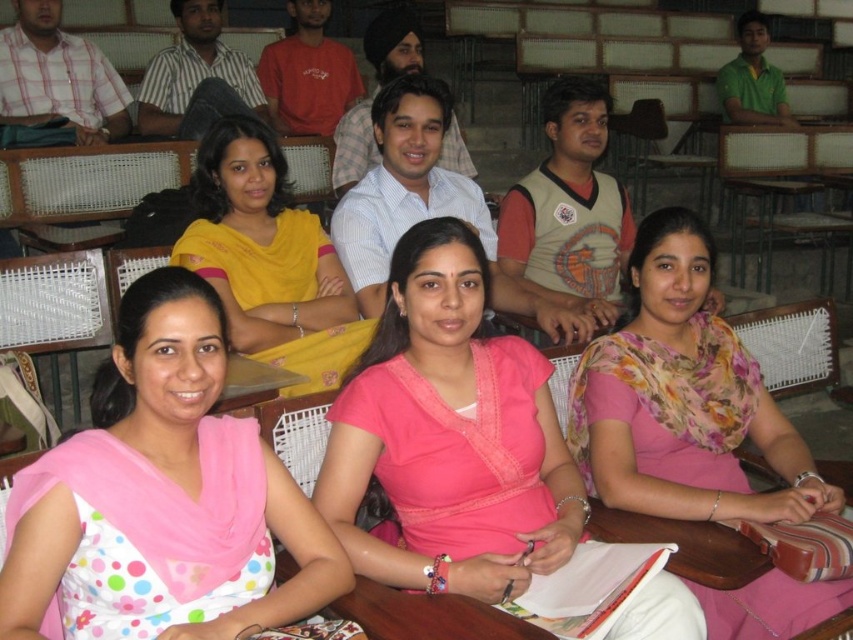
Question: Is pink satin blouse at center above floral fabric saree at center?

Choices:
 (A) yes
 (B) no

Answer: (B)

Question: Which object is positioned closest to the yellow fabric saree at center?

Choices:
 (A) pink satin blouse at center
 (B) floral fabric saree at center

Answer: (A)

Question: Which object appears farthest from the camera in this image?

Choices:
 (A) yellow fabric saree at center
 (B) floral fabric saree at center

Answer: (A)

Question: Which of the following is the farthest from the observer?

Choices:
 (A) floral fabric saree at center
 (B) pink satin blouse at center

Answer: (A)

Question: Is pink polka dot blouse at lower left to the left of yellow fabric saree at center from the viewer's perspective?

Choices:
 (A) no
 (B) yes

Answer: (A)

Question: Is pink satin blouse at center behind floral fabric saree at center?

Choices:
 (A) yes
 (B) no

Answer: (B)